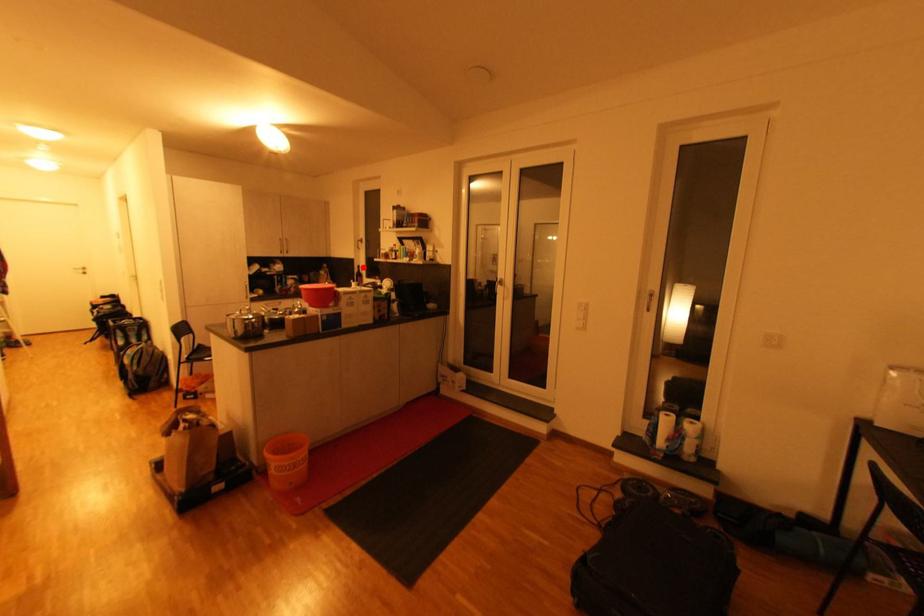
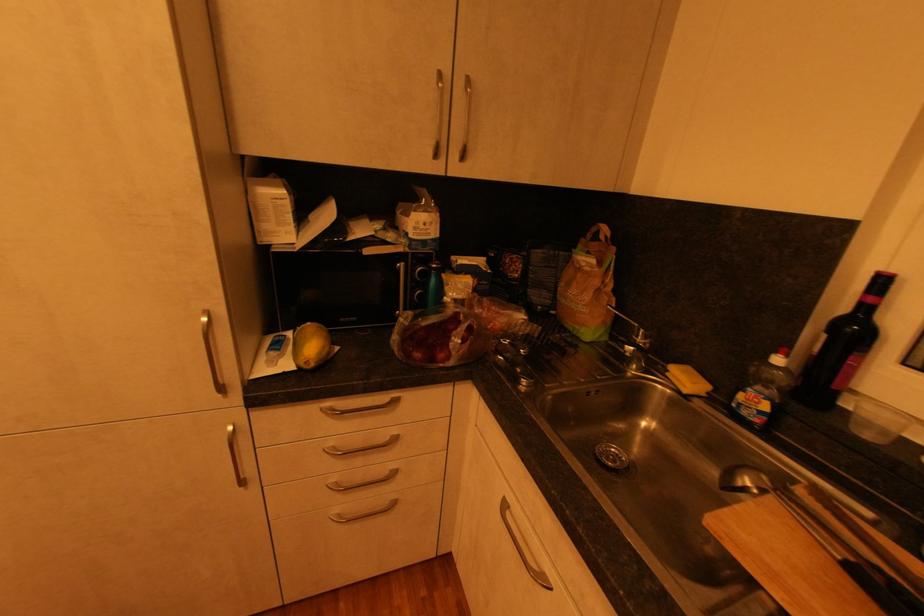
Where in the second image is the point corresponding to the highlighted location from the first image?

(889, 282)